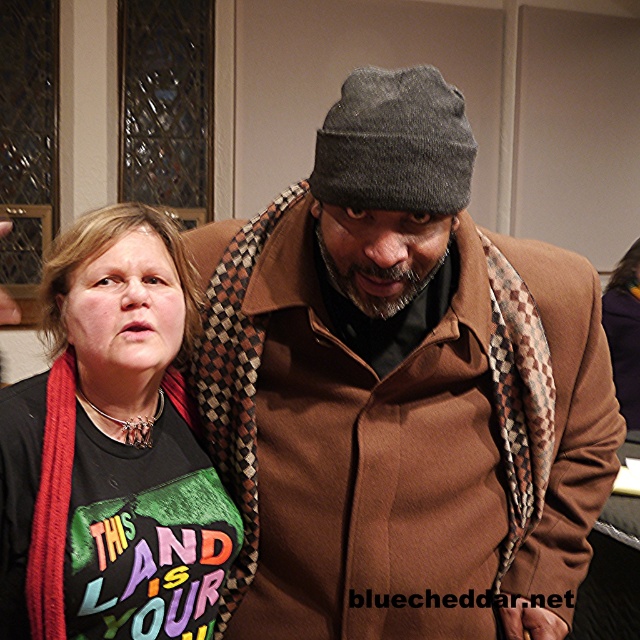
The image size is (640, 640). What do you see at coordinates (132, 435) in the screenshot?
I see `matte black t-shirt at center` at bounding box center [132, 435].

Is matte black t-shirt at center bigger than gray woolen beanie at center?

Yes, matte black t-shirt at center is bigger than gray woolen beanie at center.

Is point (113, 589) positioned after point (349, 154)?

Yes, it is behind point (349, 154).

I want to click on matte black t-shirt at center, so click(x=132, y=435).